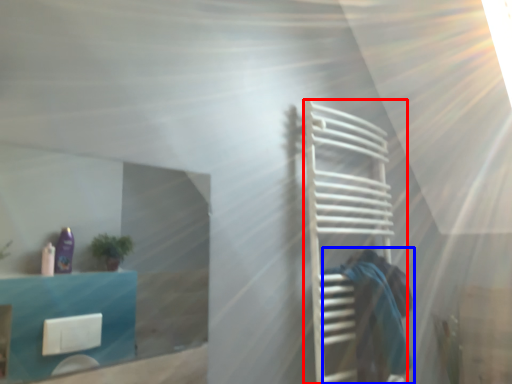
Question: Which object is further to the camera taking this photo, cage (highlighted by a red box) or person (highlighted by a blue box)?

Choices:
 (A) cage
 (B) person

Answer: (B)